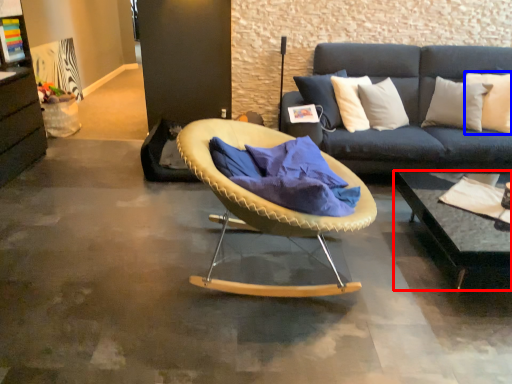
Question: Which of the following is the closest to the observer, coffee table (highlighted by a red box) or pillow (highlighted by a blue box)?

Choices:
 (A) coffee table
 (B) pillow

Answer: (A)